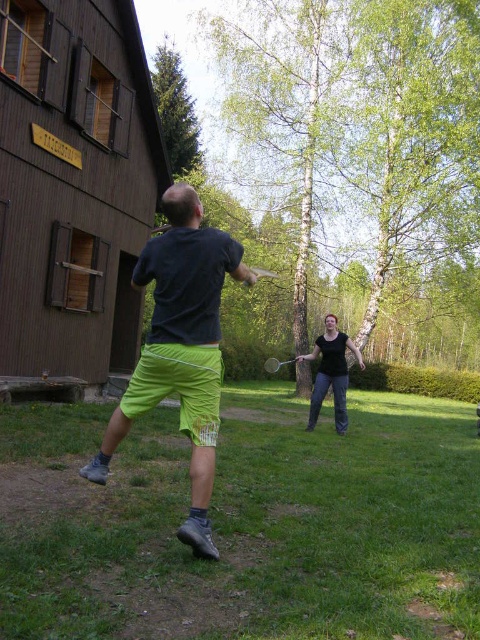
You are standing at the point with coordinates point (x=331, y=372). What is the color of the clothing item you are currently standing on?

The point (x=331, y=372) is on black cotton shirt at center, so the color of the clothing item is black.

You are standing at the point with coordinates (180, 348) in the image. What object are you directly above?

The point at (180, 348) is directly above the neon green shorts at center.